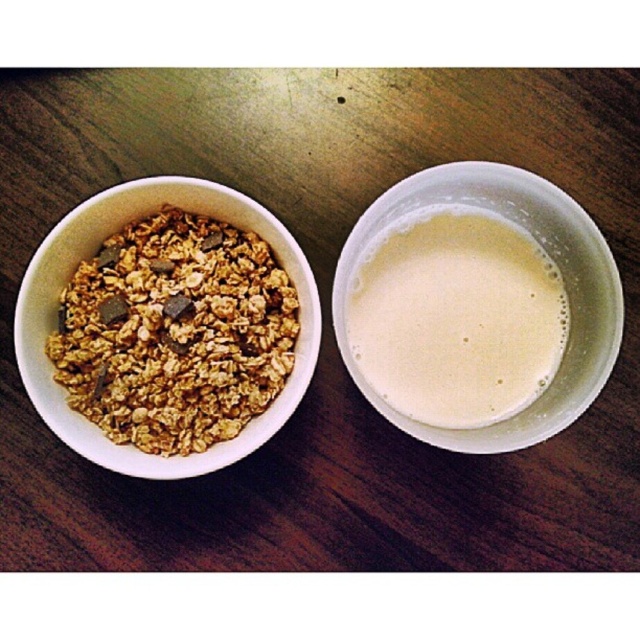
Question: Which point is farther to the camera?

Choices:
 (A) white creamy liquid at right
 (B) matte ceramic bowl at left

Answer: (A)

Question: Which object is farther from the camera taking this photo?

Choices:
 (A) matte ceramic bowl at left
 (B) white creamy liquid at right

Answer: (B)

Question: Observing the image, what is the correct spatial positioning of white creamy liquid at right in reference to matte ceramic bowl at left?

Choices:
 (A) right
 (B) left

Answer: (A)

Question: Is white creamy liquid at right behind matte ceramic bowl at left?

Choices:
 (A) no
 (B) yes

Answer: (B)

Question: Is white creamy liquid at right below matte ceramic bowl at left?

Choices:
 (A) yes
 (B) no

Answer: (B)

Question: Which point is closer to the camera taking this photo?

Choices:
 (A) (445, 316)
 (B) (157, 188)

Answer: (B)